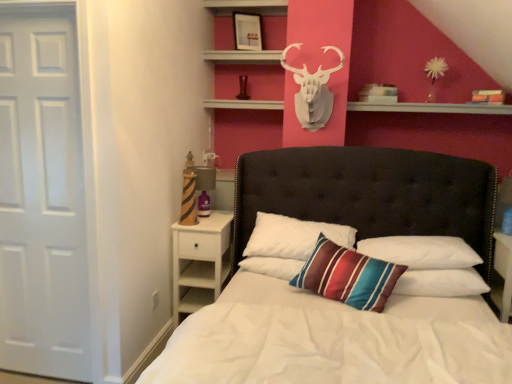
Where is `vacant space in matte black picture frame at upper center (from a real-world perspective)`? The width and height of the screenshot is (512, 384). vacant space in matte black picture frame at upper center (from a real-world perspective) is located at coordinates (246, 45).